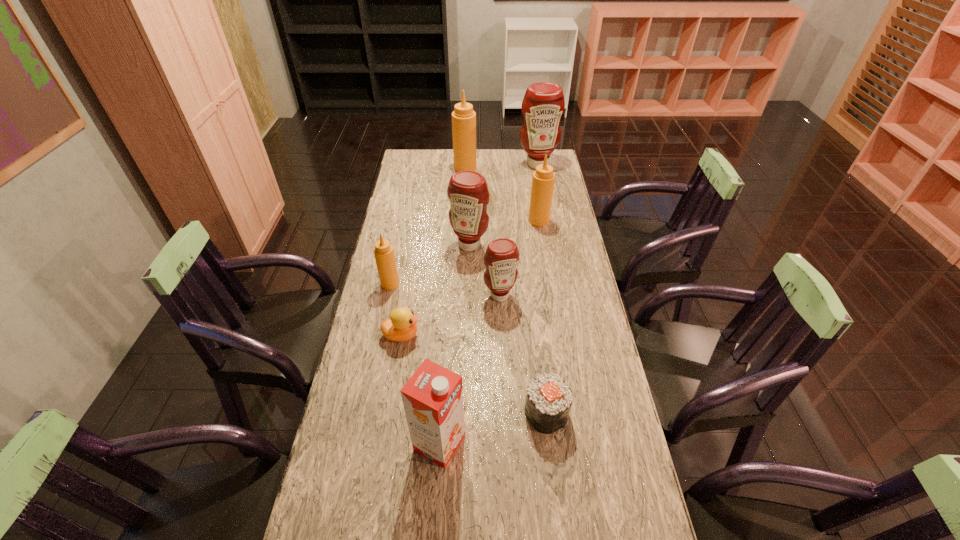
In order to click on the leftmost condiment in this screenshot , I will do `click(384, 255)`.

Where is `the smallest red condiment`? the smallest red condiment is located at coordinates (501, 257).

The image size is (960, 540). Find the location of `yellow duckling`. yellow duckling is located at coordinates (401, 326).

This screenshot has width=960, height=540. Find the location of `duckling`. duckling is located at coordinates (401, 326).

The height and width of the screenshot is (540, 960). What are the coordinates of `sushi` in the screenshot? It's located at (548, 401).

At what (x,y) coordinates should I click in order to perform the action: click on vacant space located on the left of the rightmost red condiment. Please return your answer as a coordinate pair (x, y). Looking at the image, I should click on (472, 164).

Identify the location of vacant space located on the left of the biggest tan condiment. (408, 168).

Identify the location of vacant area located 0.090m on the left of the fourth nearest condiment. The height and width of the screenshot is (540, 960). (507, 220).

Where is `free location located 0.400m on the front of the sixth nearest object`? The image size is (960, 540). free location located 0.400m on the front of the sixth nearest object is located at coordinates coord(467,338).

The height and width of the screenshot is (540, 960). I want to click on free space located on the back of the carton, so click(x=445, y=353).